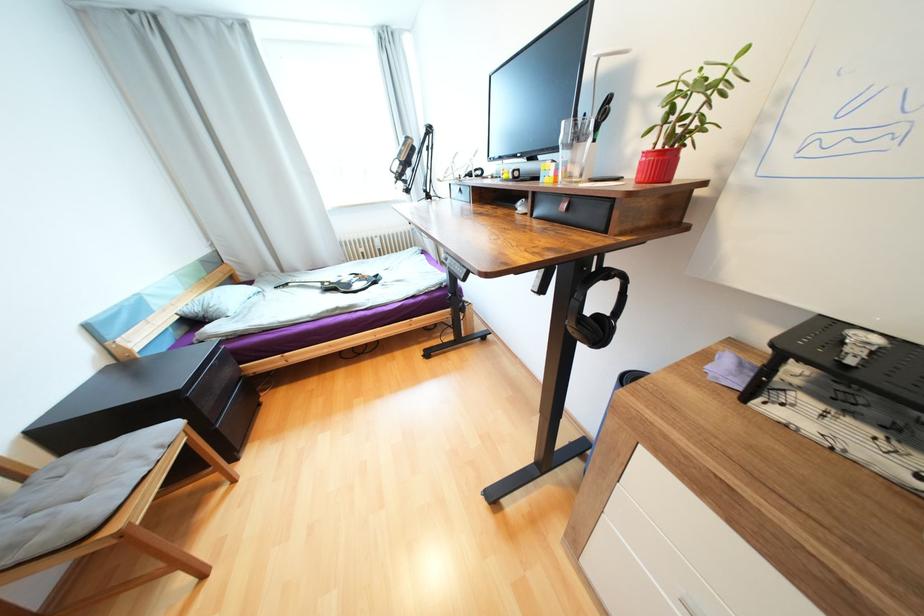
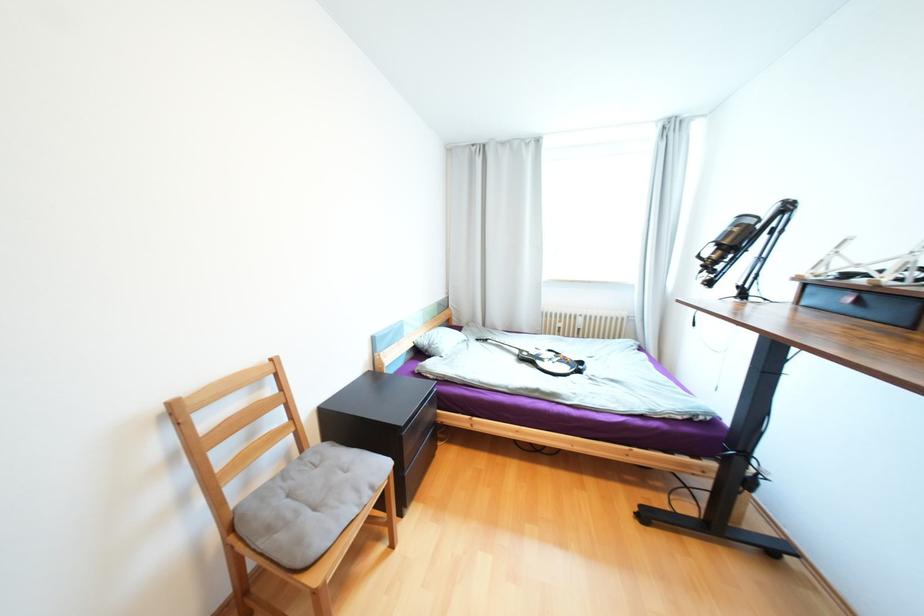
Question: The images are taken continuously from a first-person perspective. In which direction is your viewpoint rotating?

Choices:
 (A) Left
 (B) Right
 (C) Up
 (D) Down

Answer: (A)